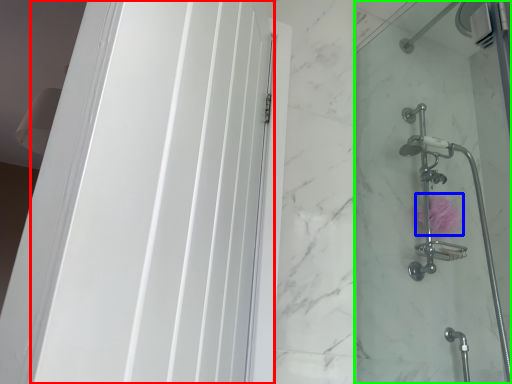
Question: Which object is positioned closest to screen door (highlighted by a red box)? Select from flower (highlighted by a blue box) and shower door (highlighted by a green box).

Choices:
 (A) flower
 (B) shower door

Answer: (B)